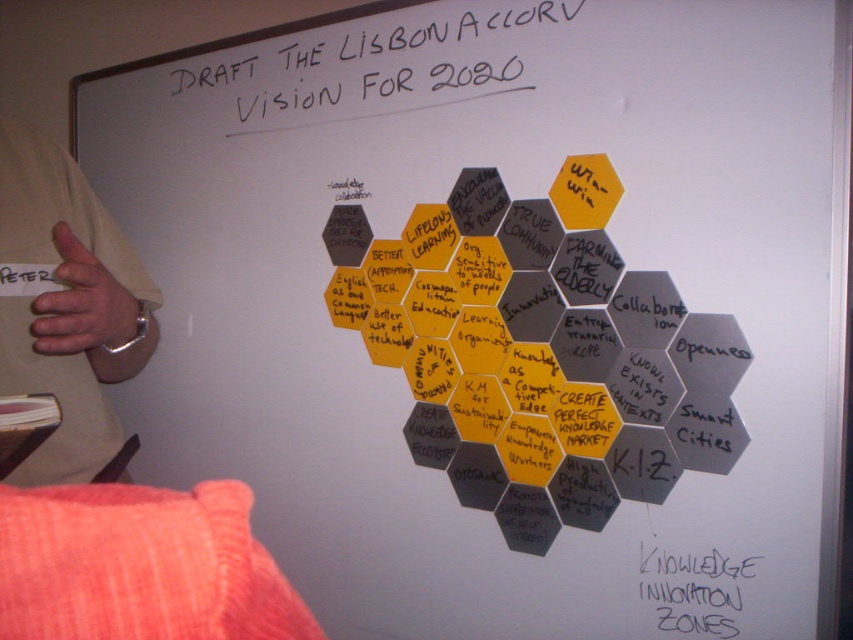
You are an assistant organizing a meeting. You need to determine if the white marker text at upper center is bigger than the black paper at center. Can you confirm this?

The white marker text at upper center is larger in size than the black paper at center, so yes, the white marker text at upper center is bigger than the black paper at center.

You are standing 36 inches away from the whiteboard and want to read the white marker text at upper center. Can you read it clearly?

The white marker text at upper center is 36.43 inches away from the viewer, so you are standing at 36 inches, which is slightly closer. Therefore, you can read the white marker text at upper center clearly.